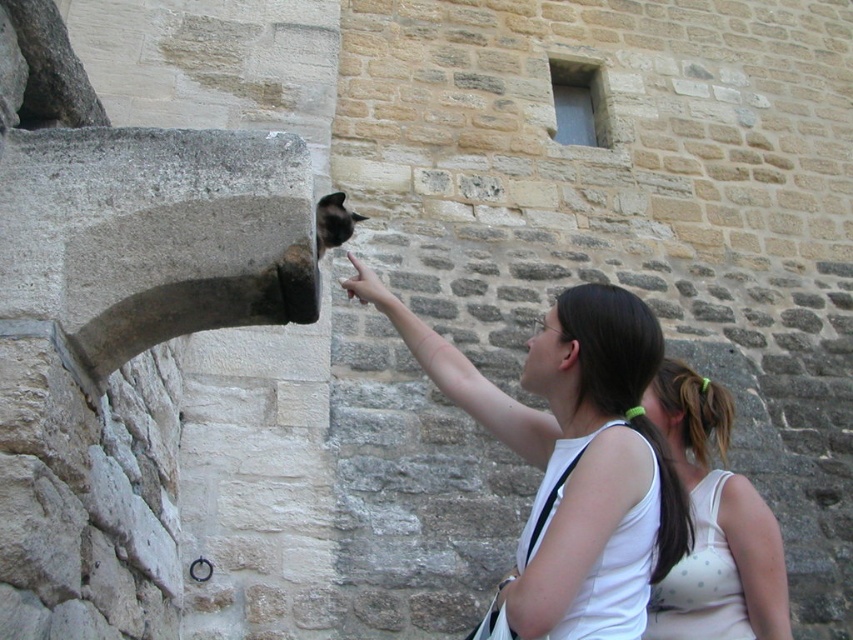
You are a fashion designer observing two people in an old stone building. You notice a white tank top at center and a white polka dot tank top at lower right. Which one is located more to the left?

The white tank top at center is more to the left than the white polka dot tank top at lower right.